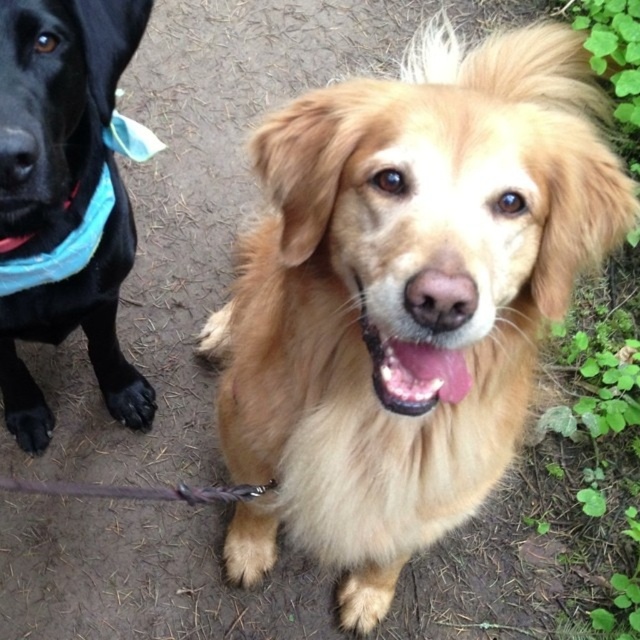
Between golden fluffy dog at center and shiny black dog at left, which one has less height?

shiny black dog at left

Between golden fluffy dog at center and shiny black dog at left, which one appears on the left side from the viewer's perspective?

shiny black dog at left is more to the left.

Where is `golden fluffy dog at center`? The height and width of the screenshot is (640, 640). golden fluffy dog at center is located at coordinates (404, 296).

Does shiny black dog at left have a greater height compared to blue fabric neckband at left?

Yes.

Is shiny black dog at left closer to the viewer compared to blue fabric neckband at left?

Yes, shiny black dog at left is closer to the viewer.

This screenshot has width=640, height=640. In order to click on shiny black dog at left in this screenshot , I will do `click(65, 198)`.

Can you confirm if golden fluffy dog at center is thinner than blue fabric neckband at left?

Incorrect, golden fluffy dog at center's width is not less than blue fabric neckband at left's.

Is golden fluffy dog at center to the right of blue fabric neckband at left from the viewer's perspective?

Correct, you'll find golden fluffy dog at center to the right of blue fabric neckband at left.

Which is in front, point (412, 506) or point (45, 272)?

Point (412, 506)

The image size is (640, 640). What are the coordinates of `golden fluffy dog at center` in the screenshot? It's located at (404, 296).